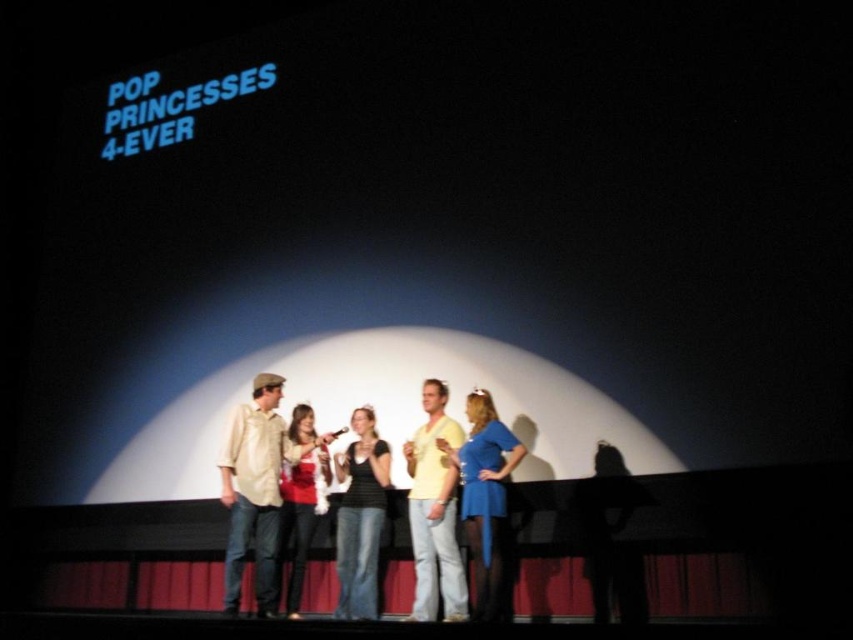
Does yellow matte shirt at center have a lesser height compared to silhouette dress at right?

Incorrect, yellow matte shirt at center's height does not fall short of silhouette dress at right's.

Between yellow matte shirt at center and silhouette dress at right, which one has less height?

silhouette dress at right

Does point (421, 618) lie behind point (585, 492)?

No, it is not.

Identify the location of yellow matte shirt at center. (434, 512).

Does matte blue dress at center have a larger size compared to black matte tank top at center?

No.

This screenshot has height=640, width=853. What do you see at coordinates (485, 499) in the screenshot?
I see `matte blue dress at center` at bounding box center [485, 499].

Where is `matte blue dress at center`? The height and width of the screenshot is (640, 853). matte blue dress at center is located at coordinates (485, 499).

Is yellow matte shirt at center thinner than matte blue dress at center?

Yes.

From the picture: Is yellow matte shirt at center to the left of matte blue dress at center from the viewer's perspective?

Correct, you'll find yellow matte shirt at center to the left of matte blue dress at center.

The image size is (853, 640). I want to click on yellow matte shirt at center, so click(434, 512).